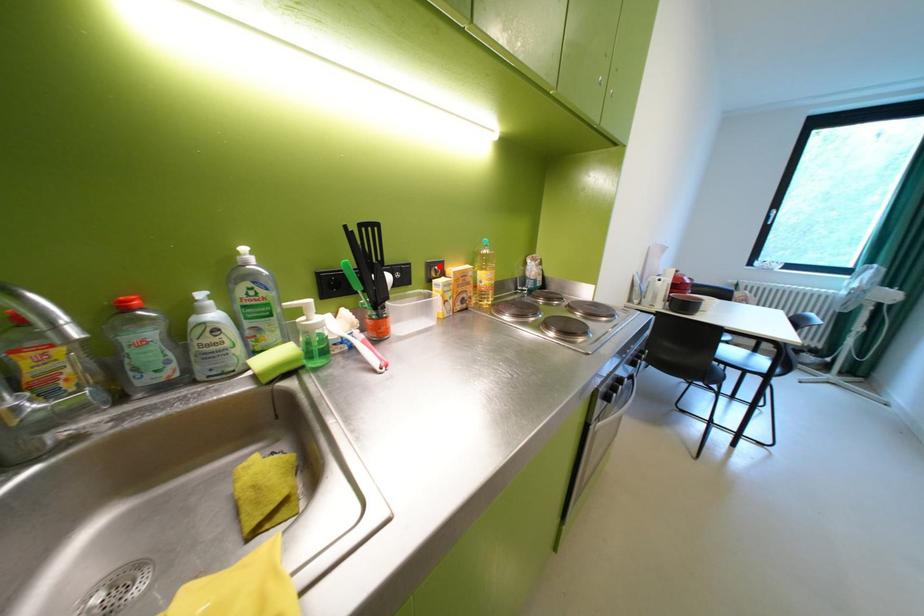
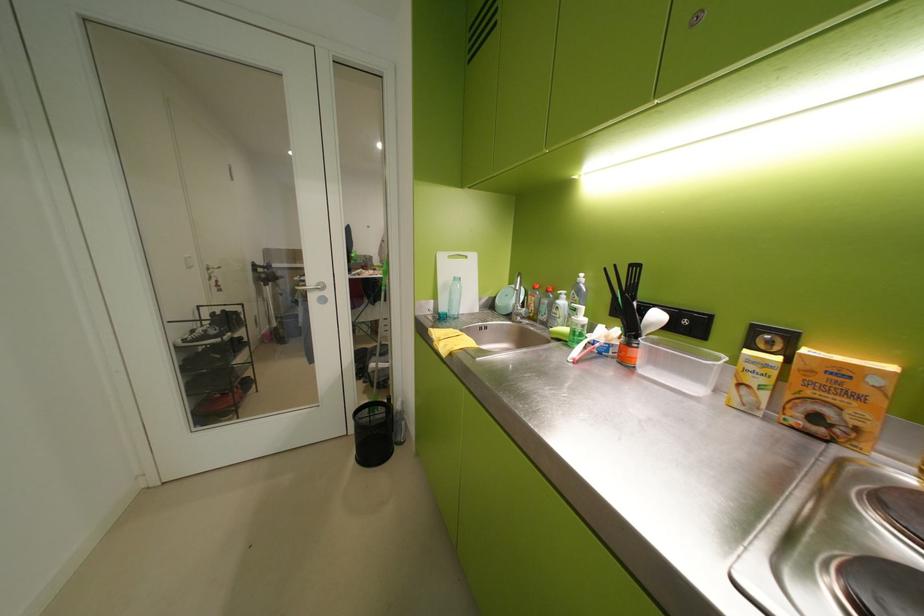
Locate, in the second image, the point that corresponds to the highlighted location in the first image.

(767, 331)